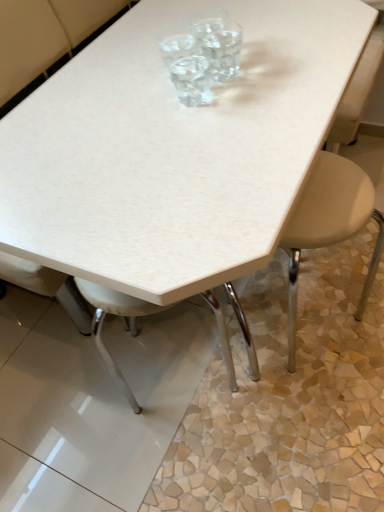
The image size is (384, 512). I want to click on vacant area that is in front of beige plastic chair at lower right, so click(x=319, y=452).